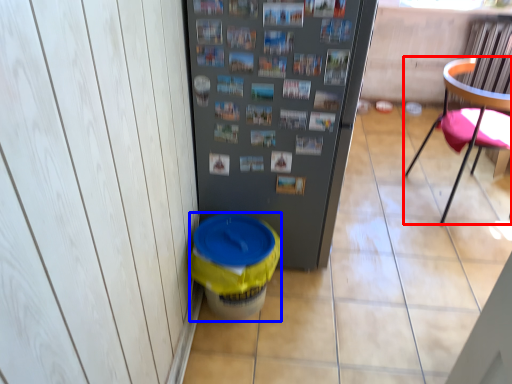
Question: Among these objects, which one is nearest to the camera, chair (highlighted by a red box) or potty (highlighted by a blue box)?

Choices:
 (A) chair
 (B) potty

Answer: (B)